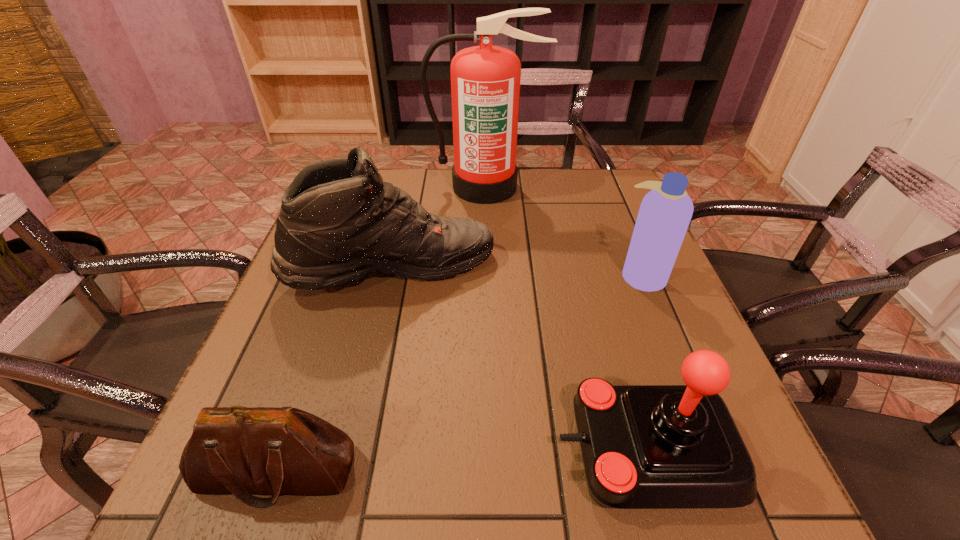
What are the coordinates of `vacant space located on the base of the joystick` in the screenshot? It's located at (406, 450).

Where is `free space located on the base of the joystick`? free space located on the base of the joystick is located at coordinates (412, 450).

Where is `vacant space located 0.050m on the back of the shoulder bag`? vacant space located 0.050m on the back of the shoulder bag is located at coordinates 299,407.

The height and width of the screenshot is (540, 960). Identify the location of object that is at the far edge. (485, 80).

Where is `joystick that is at the near edge`? The width and height of the screenshot is (960, 540). joystick that is at the near edge is located at coordinates (643, 446).

Where is `shoulder bag positioned at the near edge`? Image resolution: width=960 pixels, height=540 pixels. shoulder bag positioned at the near edge is located at coordinates (236, 450).

What are the coordinates of `ski boot present at the left edge` in the screenshot? It's located at (339, 222).

Locate an element on the screen. The height and width of the screenshot is (540, 960). shoulder bag present at the left edge is located at coordinates (236, 450).

Where is `shampoo located in the right edge section of the desktop`? The width and height of the screenshot is (960, 540). shampoo located in the right edge section of the desktop is located at coordinates (665, 212).

At what (x,y) coordinates should I click in order to perform the action: click on joystick located in the right edge section of the desktop. Please return your answer as a coordinate pair (x, y). Looking at the image, I should click on (643, 446).